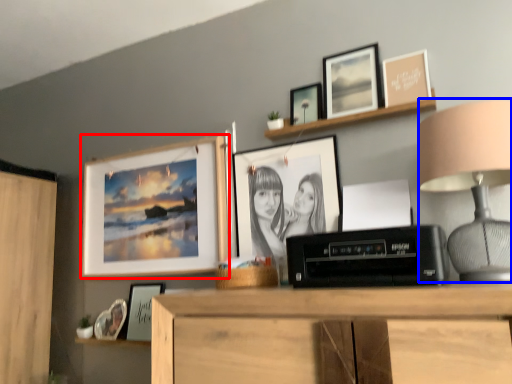
Question: Among these objects, which one is farthest to the camera, picture frame (highlighted by a red box) or table lamp (highlighted by a blue box)?

Choices:
 (A) picture frame
 (B) table lamp

Answer: (A)